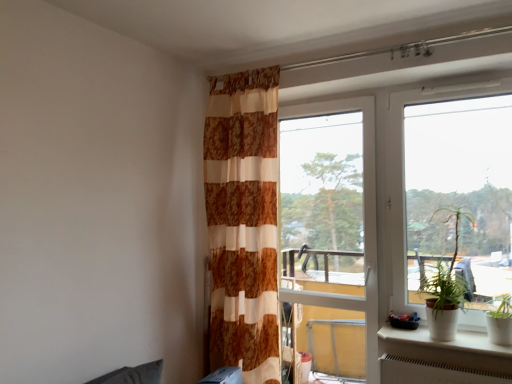
What is the approximate height of brown textured curtain at center?

It is 6.55 feet.

Find the location of a particular element. The height and width of the screenshot is (384, 512). brown textured curtain at center is located at coordinates (243, 222).

The height and width of the screenshot is (384, 512). Identify the location of transparent glass window at right. (460, 194).

This screenshot has width=512, height=384. In order to click on white ceramic pot at lower right in this screenshot , I will do `click(446, 342)`.

You are a GUI agent. You are given a task and a screenshot of the screen. Output one action in this format:
    pyautogui.click(x=<x>, y=<y>)
    Task: Click on the transparent glass screen door at center
    
    Given the screenshot: What is the action you would take?
    pyautogui.click(x=364, y=218)

In order to click on brown textured curtain at center in this screenshot , I will do `click(243, 222)`.

Is point (252, 318) behind point (455, 250)?

Yes, it is.

Can you confirm if brown textured curtain at center is thinner than green leafy plant at right?

Incorrect, the width of brown textured curtain at center is not less than that of green leafy plant at right.

In the scene shown: In terms of height, does brown textured curtain at center look taller or shorter compared to green leafy plant at right?

Considering their sizes, brown textured curtain at center has more height than green leafy plant at right.

From the image's perspective, who appears lower, brown textured curtain at center or green leafy plant at right?

Answer: green leafy plant at right is shown below in the image.

From a real-world perspective, between green leafy plant at right and transparent glass screen door at center, who is vertically higher?

transparent glass screen door at center.

Between green leafy plant at right and transparent glass screen door at center, which one has smaller size?

green leafy plant at right.

From the image's perspective, which is above, green leafy plant at right or transparent glass screen door at center?

transparent glass screen door at center is shown above in the image.

Which object is closer to the camera taking this photo, transparent glass window at right or white ceramic pot at lower right?

white ceramic pot at lower right is closer to the camera.

Is point (418, 175) closer or farther from the camera than point (432, 341)?

Point (418, 175) is farther from the camera than point (432, 341).

Is transparent glass window at right inside the boundaries of white ceramic pot at lower right, or outside?

transparent glass window at right is located beyond the bounds of white ceramic pot at lower right.

Considering the sizes of transparent glass window at right and white ceramic pot at lower right in the image, is transparent glass window at right wider or thinner than white ceramic pot at lower right?

transparent glass window at right is thinner than white ceramic pot at lower right.

Consider the image. From a real-world perspective, is green leafy plant at right physically below white ceramic pot at lower right?

Actually, green leafy plant at right is physically above white ceramic pot at lower right in the real world.

From the image's perspective, between green leafy plant at right and white ceramic pot at lower right, which one is located above?

green leafy plant at right, from the image's perspective.

Which object is wider, green leafy plant at right or white ceramic pot at lower right?

Wider between the two is white ceramic pot at lower right.

Considering the positions of objects green leafy plant at right and white ceramic pot at lower right in the image provided, who is more to the left, green leafy plant at right or white ceramic pot at lower right?

Positioned to the left is green leafy plant at right.

From the image's perspective, relative to transparent glass screen door at center, is white ceramic pot at lower right above or below?

Based on their image positions, white ceramic pot at lower right is located beneath transparent glass screen door at center.

Is white ceramic pot at lower right bigger than transparent glass screen door at center?

No.

In terms of width, does white ceramic pot at lower right look wider or thinner when compared to transparent glass screen door at center?

Considering their sizes, white ceramic pot at lower right looks broader than transparent glass screen door at center.

Can we say white ceramic pot at lower right lies outside transparent glass screen door at center?

white ceramic pot at lower right is positioned outside transparent glass screen door at center.

Does point (510, 347) come behind point (271, 127)?

No, (510, 347) is closer to viewer.

Considering the relative positions of white ceramic pot at lower right and brown textured curtain at center in the image provided, is white ceramic pot at lower right to the left or to the right of brown textured curtain at center?

white ceramic pot at lower right is positioned on brown textured curtain at center's right side.

Is white ceramic pot at lower right completely or partially outside of brown textured curtain at center?

Absolutely, white ceramic pot at lower right is external to brown textured curtain at center.

Are white ceramic pot at lower right and brown textured curtain at center making contact?

They are not placed beside each other.

From a real-world perspective, who is located higher, transparent glass screen door at center or brown textured curtain at center?

From a 3D spatial view, brown textured curtain at center is above.

Is transparent glass screen door at center aimed at brown textured curtain at center?

Yes, transparent glass screen door at center is aimed at brown textured curtain at center.

Considering the relative sizes of transparent glass screen door at center and brown textured curtain at center in the image provided, is transparent glass screen door at center taller than brown textured curtain at center?

No.

Consider the image. In the image, is transparent glass screen door at center on the left side or the right side of brown textured curtain at center?

transparent glass screen door at center is to the right of brown textured curtain at center.

What are the coordinates of `curtain that appears above the green leafy plant at right (from the image's perspective)` in the screenshot? It's located at (243, 222).

Image resolution: width=512 pixels, height=384 pixels. I want to click on screen door lying behind the green leafy plant at right, so (x=364, y=218).

When comparing their distances from white ceramic pot at lower right, does transparent glass window at right or transparent glass screen door at center seem closer?

The object closer to white ceramic pot at lower right is transparent glass screen door at center.

Which object lies further to the anchor point green leafy plant at right, brown textured curtain at center or transparent glass screen door at center?

brown textured curtain at center is positioned further to the anchor green leafy plant at right.

Based on their spatial positions, is transparent glass screen door at center or transparent glass window at right further from brown textured curtain at center?

transparent glass window at right lies further to brown textured curtain at center than the other object.

Which object lies nearer to the anchor point white ceramic pot at lower right, green leafy plant at right or brown textured curtain at center?

green leafy plant at right is positioned closer to the anchor white ceramic pot at lower right.

Which object lies further to the anchor point green leafy plant at right, brown textured curtain at center or transparent glass window at right?

brown textured curtain at center.

From the image, which object appears to be nearer to white ceramic pot at lower right, transparent glass screen door at center or transparent glass window at right?

transparent glass screen door at center is closer to white ceramic pot at lower right.

Based on their spatial positions, is green leafy plant at right or white ceramic pot at lower right further from transparent glass screen door at center?

white ceramic pot at lower right is positioned further to the anchor transparent glass screen door at center.

Which object lies further to the anchor point white ceramic pot at lower right, green leafy plant at right or transparent glass screen door at center?

transparent glass screen door at center is further to white ceramic pot at lower right.

Where is `screen door between brown textured curtain at center and transparent glass window at right`? The height and width of the screenshot is (384, 512). screen door between brown textured curtain at center and transparent glass window at right is located at coordinates (364, 218).

Where is `screen door that lies between transparent glass window at right and white ceramic pot at lower right from top to bottom`? screen door that lies between transparent glass window at right and white ceramic pot at lower right from top to bottom is located at coordinates (364, 218).

Find the location of a particular element. This screenshot has width=512, height=384. houseplant located between brown textured curtain at center and white ceramic pot at lower right in the left-right direction is located at coordinates (445, 284).

Where is `houseplant between brown textured curtain at center and transparent glass window at right`? houseplant between brown textured curtain at center and transparent glass window at right is located at coordinates (445, 284).